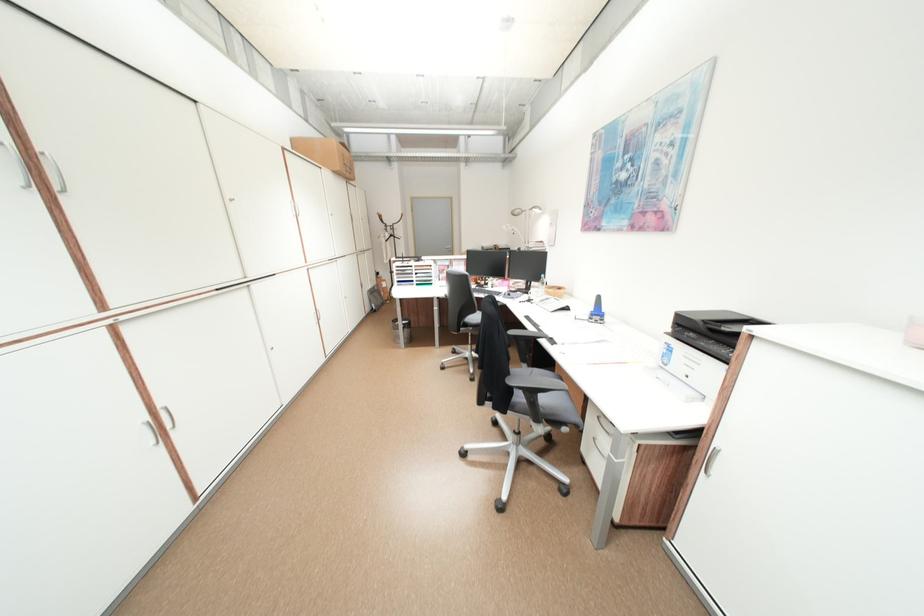
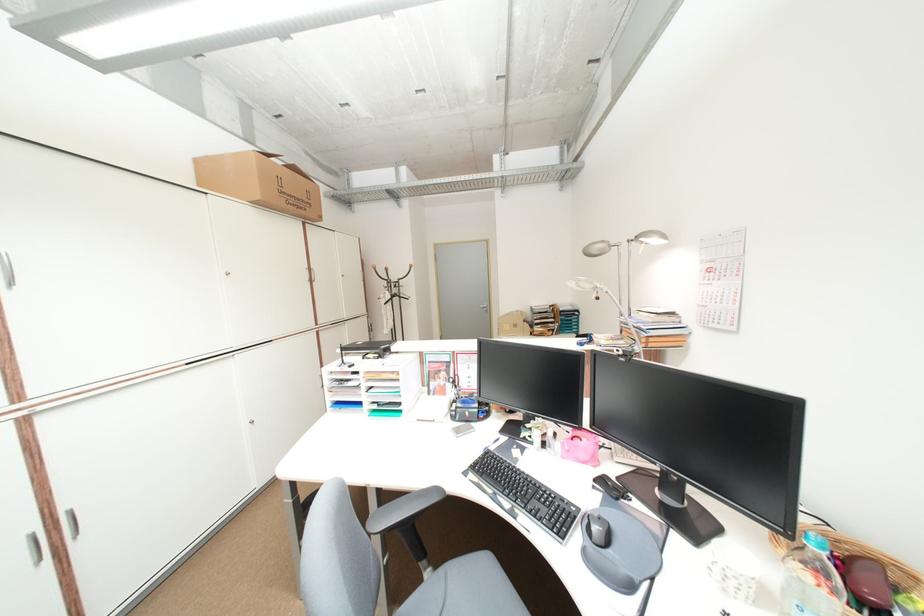
The point at (396, 236) is marked in the first image. Where is the corresponding point in the second image?

(397, 296)